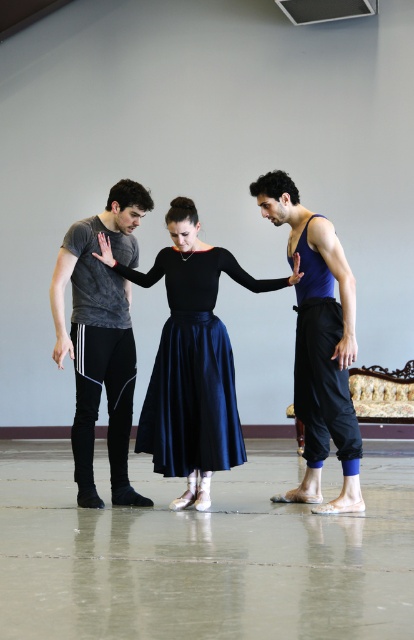
Who is more distant from viewer, (178,410) or (266,179)?

The point (178,410) is behind.

Between point (159, 394) and point (337, 508), which one is positioned behind?

The point (159, 394) is behind.

At what (x,y) coordinates should I click in order to perform the action: click on satin skirt at center. Please return your answer as a coordinate pair (x, y). The width and height of the screenshot is (414, 640). Looking at the image, I should click on (192, 365).

Who is higher up, dark gray matte t-shirt at left or blue fabric tank top at center?

blue fabric tank top at center is higher up.

Which of these two, dark gray matte t-shirt at left or blue fabric tank top at center, stands taller?

blue fabric tank top at center

Identify the location of dark gray matte t-shirt at left. (101, 337).

Does satin skirt at center lie in front of dark gray matte t-shirt at left?

No, satin skirt at center is further to the viewer.

Is the position of satin skirt at center more distant than that of dark gray matte t-shirt at left?

Yes, satin skirt at center is further from the viewer.

This screenshot has width=414, height=640. I want to click on satin skirt at center, so click(x=192, y=365).